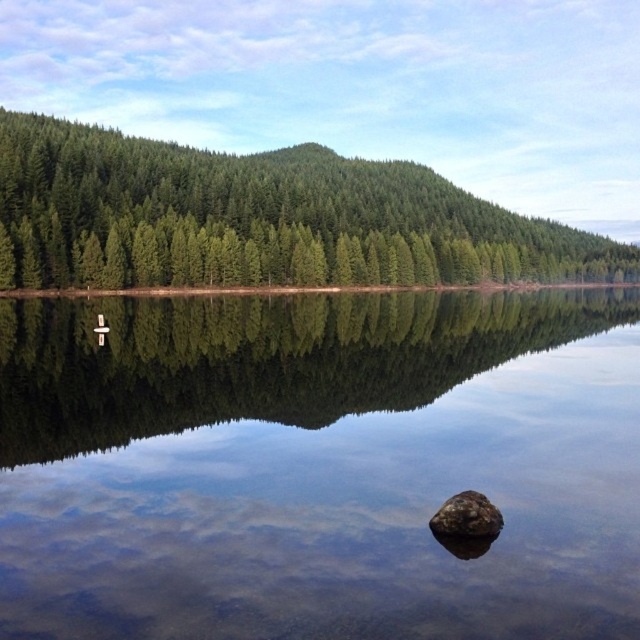
Is clear glass water at center further to camera compared to brown rough rock at center?

No.

Between clear glass water at center and brown rough rock at center, which one is positioned higher?

clear glass water at center is above.

Where is `clear glass water at center`? clear glass water at center is located at coordinates (317, 465).

Between clear glass water at center and green matte trees at upper center, which one has more height?

green matte trees at upper center

Does point (188, 529) come behind point (500, 262)?

No, it is not.

Is point (68, 632) positioned in front of point (195, 250)?

Yes, it is in front of point (195, 250).

Identify the location of clear glass water at center. (317, 465).

Does green matte trees at upper center have a lesser width compared to brown rough rock at center?

In fact, green matte trees at upper center might be wider than brown rough rock at center.

Can you confirm if green matte trees at upper center is positioned to the right of brown rough rock at center?

Correct, you'll find green matte trees at upper center to the right of brown rough rock at center.

Is point (568, 260) positioned behind point (456, 496)?

Yes, point (568, 260) is behind point (456, 496).

Identify the location of green matte trees at upper center. (259, 218).